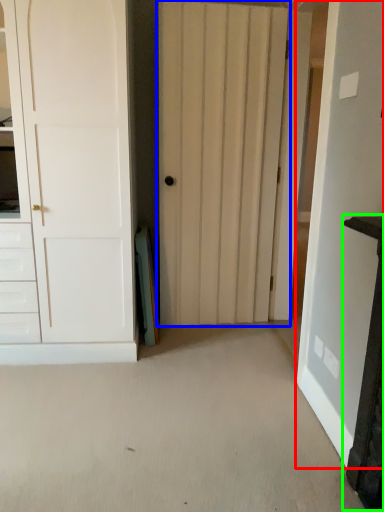
Question: Considering the real-world distances, which object is closest to door (highlighted by a red box)? door (highlighted by a blue box) or vanity (highlighted by a green box).

Choices:
 (A) door
 (B) vanity

Answer: (B)